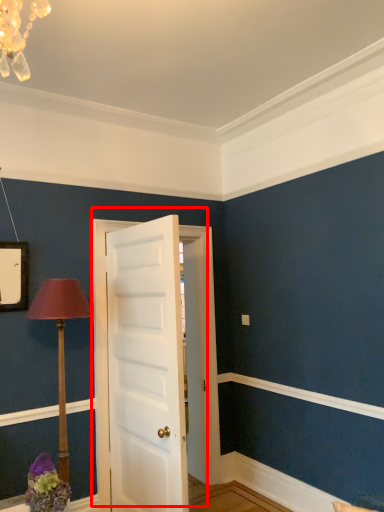
Question: From the image's perspective, what is the correct spatial positioning of door (annotated by the red box) in reference to table lamp?

Choices:
 (A) above
 (B) below

Answer: (A)